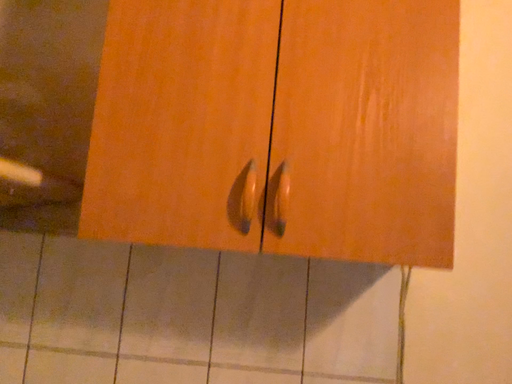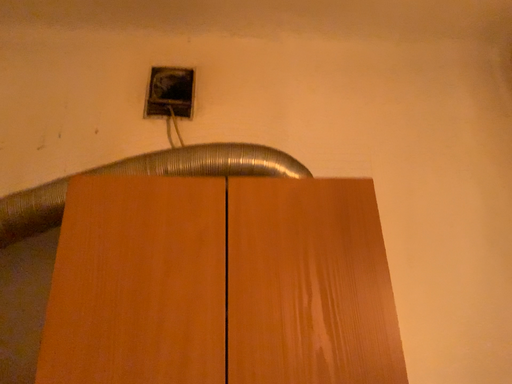
Question: Which way did the camera rotate in the video?

Choices:
 (A) rotated left
 (B) rotated right

Answer: (B)